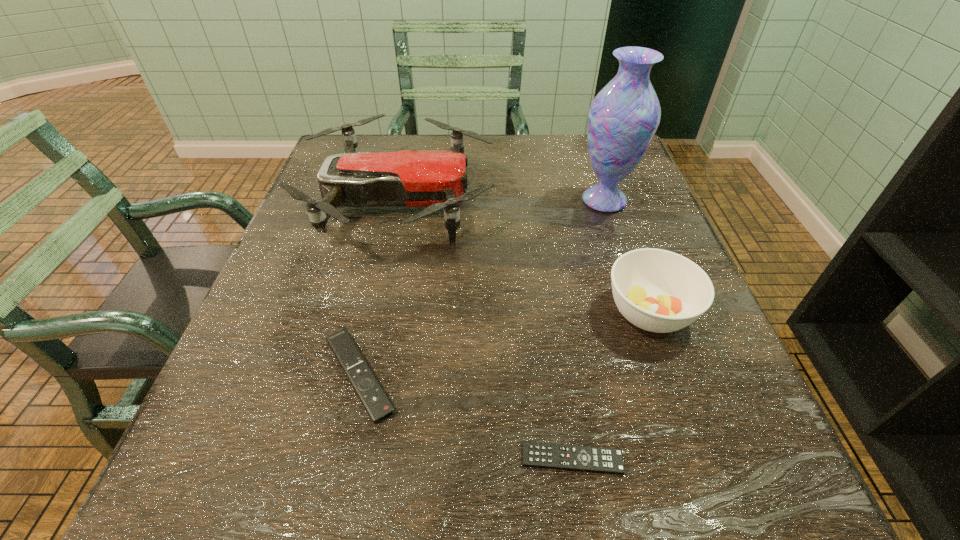
At what (x,y) coordinates should I click in order to perform the action: click on empty space between the fourth shortest object and the tallest object. Please return your answer as a coordinate pair (x, y). The image size is (960, 540). Looking at the image, I should click on (502, 201).

What are the coordinates of `vacant space in between the drone and the third shortest object` in the screenshot? It's located at (524, 258).

You are a GUI agent. You are given a task and a screenshot of the screen. Output one action in this format:
    pyautogui.click(x=<x>, y=<y>)
    Task: Click on the free space between the shortest object and the left remote control
    This screenshot has height=540, width=960.
    Given the screenshot: What is the action you would take?
    pyautogui.click(x=466, y=417)

Identify which object is the closest to the shorter remote control. Please provide its 2D coordinates. Your answer should be formatted as a tuple, i.e. [(x, y)], where the tuple contains the x and y coordinates of a point satisfying the conditions above.

[(660, 291)]

This screenshot has height=540, width=960. I want to click on object that is the nearest to the third object from left to right, so tap(660, 291).

Find the location of a particular element. Image resolution: width=960 pixels, height=540 pixels. free space that satisfies the following two spatial constraints: 1. on the front-facing side of the third shortest object; 2. on the right side of the drone is located at coordinates (375, 312).

I want to click on free space that satisfies the following two spatial constraints: 1. on the back side of the nearer remote control; 2. on the front-facing side of the drone, so click(x=534, y=202).

The image size is (960, 540). In order to click on free space that satisfies the following two spatial constraints: 1. on the front side of the vase; 2. on the front-facing side of the drone in this screenshot , I will do `click(605, 202)`.

Locate an element on the screen. Image resolution: width=960 pixels, height=540 pixels. blank area in the image that satisfies the following two spatial constraints: 1. on the back side of the nearest object; 2. on the front-facing side of the fourth shortest object is located at coordinates (534, 202).

Find the location of a particular element. vacant region that satisfies the following two spatial constraints: 1. on the front-facing side of the second tallest object; 2. on the left side of the soup bowl is located at coordinates (375, 312).